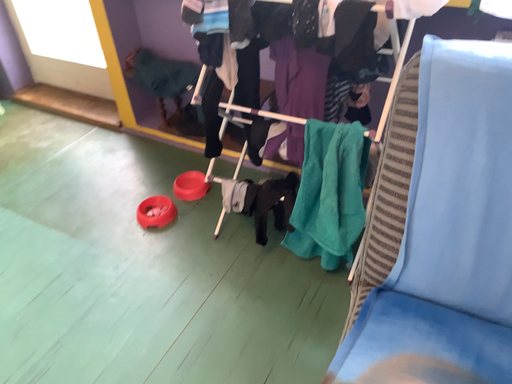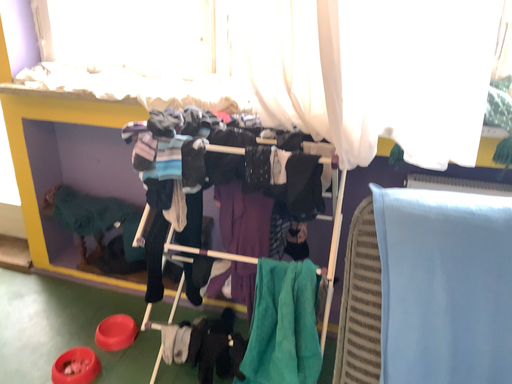
Question: Which way did the camera rotate in the video?

Choices:
 (A) rotated left
 (B) rotated right

Answer: (B)